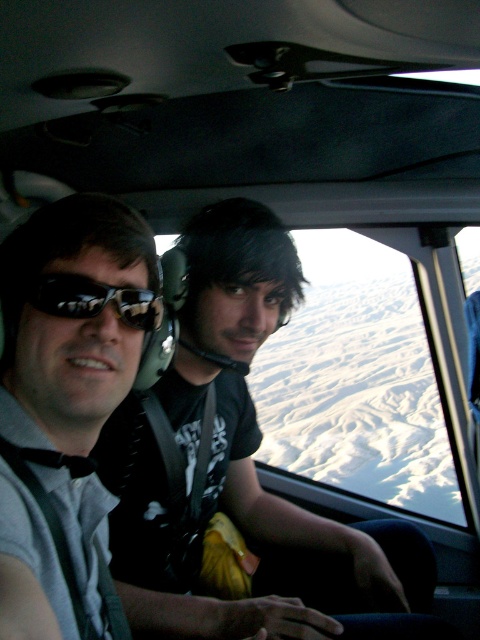
Is point (278, 253) more distant than point (141, 314)?

That is True.

Based on the photo, can you confirm if matte black helmet at center is positioned to the right of matte black sunglasses at left?

Indeed, matte black helmet at center is positioned on the right side of matte black sunglasses at left.

At what (x,y) coordinates should I click in order to perform the action: click on matte black helmet at center. Please return your answer as a coordinate pair (x, y). The width and height of the screenshot is (480, 640). Looking at the image, I should click on (240, 460).